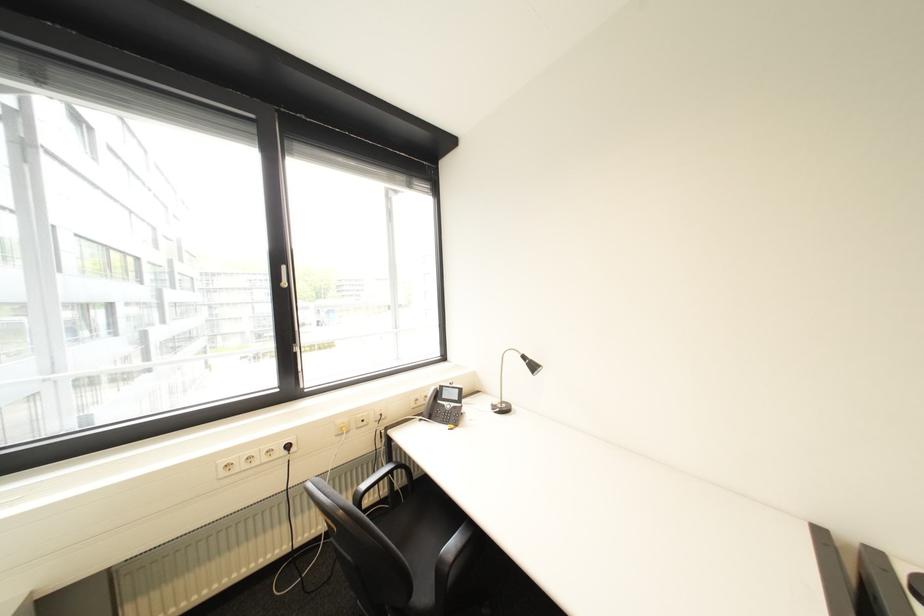
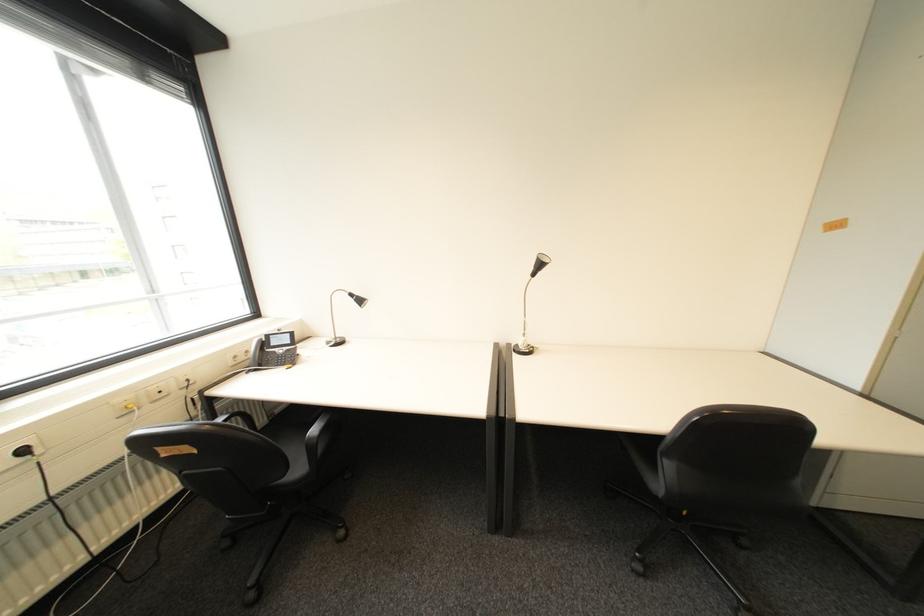
In the second image, find the point that corresponds to pixel 298 447 in the first image.

(34, 452)